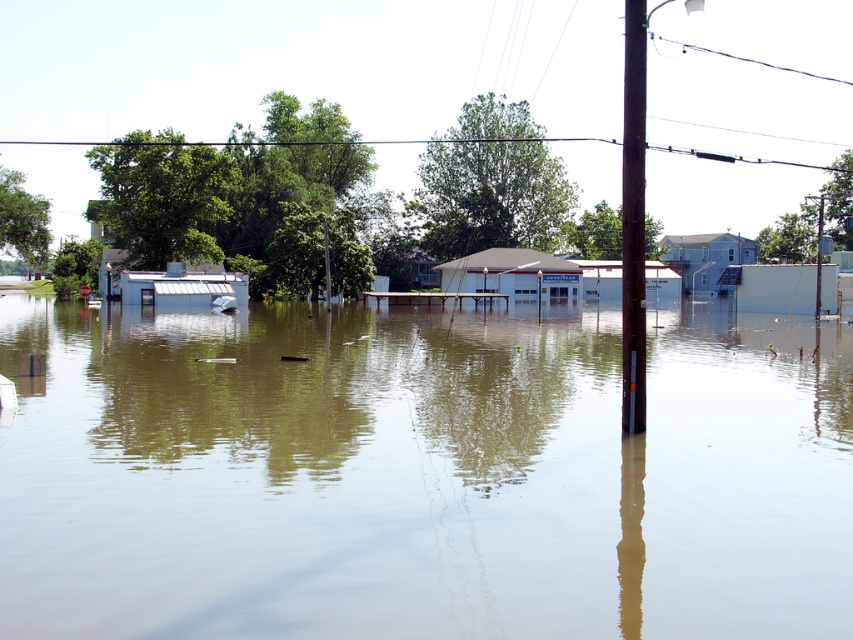
You are a rescue worker trying to navigate through the flooded area. You see the brown murky water at center and the brown wooden pole at center. Which object is taller?

The brown wooden pole at center is taller than the brown murky water at center.

You are navigating a small boat through the flooded area and need to reach a safe zone. There are two points marked on your map as point 1 at coordinates point (x=763, y=353) and point 2 at coordinates point (x=625, y=266). Which point is closer to your current position if you are approaching from the front of the scene?

Point 2 at coordinates point (x=625, y=266) is closer to your current position because it is in front of point 1 at coordinates point (x=763, y=353), which is further back in the scene.